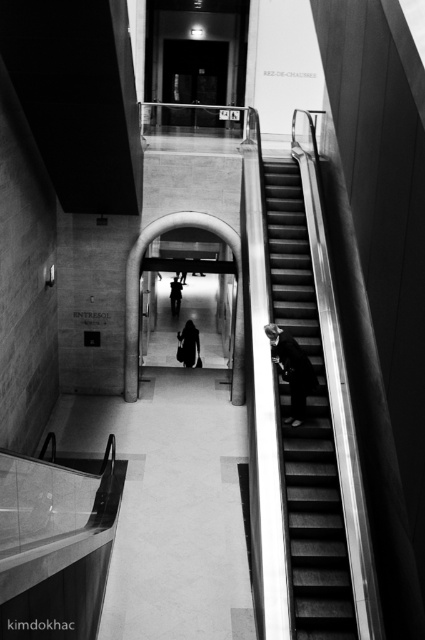
You are standing at the entrance of this modern building and see the metallic silver stairs at right and the dark gray suit at right. Which object is positioned to the left when viewed from your perspective?

The metallic silver stairs at right is to the left of dark gray suit at right.

You are an interior designer assessing the layout of this modern space. You notice the dark gray suit at right and the dark fabric coat at center. Which object is positioned closer to the floor?

The dark gray suit at right is positioned closer to the floor because it is below the dark fabric coat at center.

You are standing in the entrance of this modern building and see the metallic silver stairs at right and the dark fabric bag at center. Which object is located to the right of the other?

The metallic silver stairs at right is positioned on the right side of dark fabric bag at center.